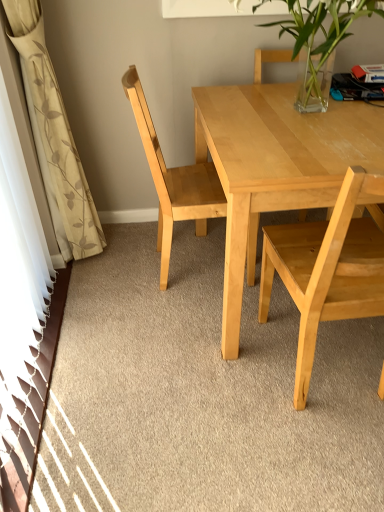
Where is `vacant space in front of white floral fabric curtain at left`? Image resolution: width=384 pixels, height=512 pixels. vacant space in front of white floral fabric curtain at left is located at coordinates (100, 313).